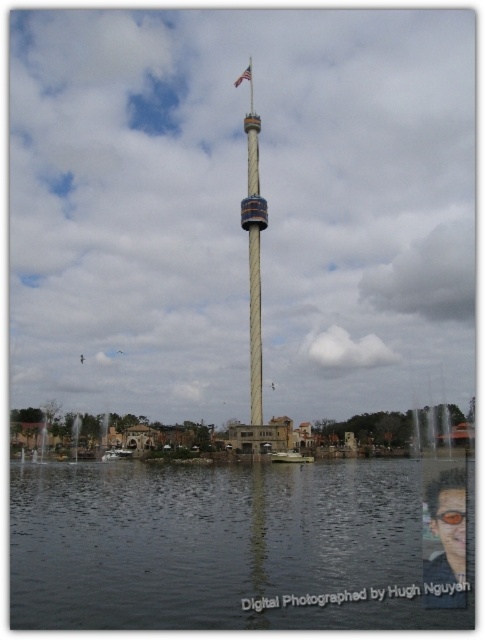
Question: Considering the relative positions of orange plastic goggles at center and metallic flag pole at center in the image provided, where is orange plastic goggles at center located with respect to metallic flag pole at center?

Choices:
 (A) left
 (B) right

Answer: (B)

Question: In this image, where is smooth beige tower at center located relative to metallic flag pole at center?

Choices:
 (A) right
 (B) left

Answer: (A)

Question: Which point is closer to the camera?

Choices:
 (A) (430, 513)
 (B) (441, 513)

Answer: (B)

Question: Among these objects, which one is farthest from the camera?

Choices:
 (A) smooth beige tower at center
 (B) orange plastic goggles at center
 (C) shiny black sunglasses at lower right

Answer: (A)

Question: Which object appears farthest from the camera in this image?

Choices:
 (A) orange plastic goggles at center
 (B) metallic flag pole at center

Answer: (B)

Question: Where is dark reflective water at center located in relation to smooth beige tower at center in the image?

Choices:
 (A) below
 (B) above

Answer: (A)